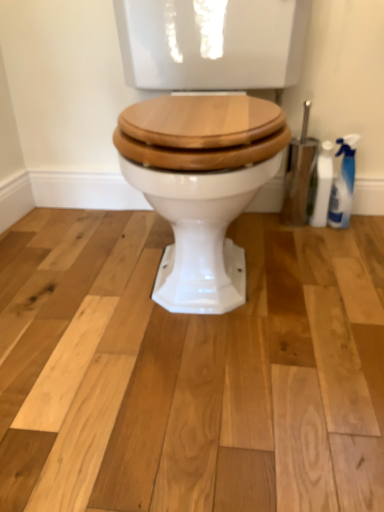
Where is `white plastic spray bottle at right, arranged as the 1th cleaning product when viewed from the left`? This screenshot has width=384, height=512. white plastic spray bottle at right, arranged as the 1th cleaning product when viewed from the left is located at coordinates (323, 185).

The height and width of the screenshot is (512, 384). Describe the element at coordinates (323, 185) in the screenshot. I see `white plastic spray bottle at right, arranged as the 1th cleaning product when viewed from the left` at that location.

What is the approximate width of white plastic spray bottle at right, arranged as the 1th cleaning product when viewed from the left?

The width of white plastic spray bottle at right, arranged as the 1th cleaning product when viewed from the left, is 5.87 centimeters.

How much space does translucent plastic spray bottle at right, arranged as the 1th cleaning product when viewed from the right, occupy vertically?

translucent plastic spray bottle at right, arranged as the 1th cleaning product when viewed from the right, is 29.59 centimeters tall.

This screenshot has width=384, height=512. What do you see at coordinates (343, 183) in the screenshot? I see `translucent plastic spray bottle at right, the 2th cleaning product from the left` at bounding box center [343, 183].

Identify the location of translucent plastic spray bottle at right, arranged as the 1th cleaning product when viewed from the right. The image size is (384, 512). (343, 183).

Consider the image. In order to face translucent plastic spray bottle at right, the 2th cleaning product from the left, should I rotate leftwards or rightwards?

To align with it, rotate right about 19.629°.

At what (x,y) coordinates should I click in order to perform the action: click on white plastic spray bottle at right, arranged as the 1th cleaning product when viewed from the left. Please return your answer as a coordinate pair (x, y). This screenshot has height=512, width=384. Looking at the image, I should click on (323, 185).

Between translucent plastic spray bottle at right, arranged as the 1th cleaning product when viewed from the right, and white plastic spray bottle at right, which ranks as the second cleaning product in right-to-left order, which one appears on the left side from the viewer's perspective?

white plastic spray bottle at right, which ranks as the second cleaning product in right-to-left order.

Does translucent plastic spray bottle at right, the 2th cleaning product from the left, lie in front of white plastic spray bottle at right, which ranks as the second cleaning product in right-to-left order?

Yes, translucent plastic spray bottle at right, the 2th cleaning product from the left, is closer to the viewer.

Does point (346, 194) come behind point (329, 194)?

No, it is in front of (329, 194).

Looking at this image, from the image's perspective, is translucent plastic spray bottle at right, arranged as the 1th cleaning product when viewed from the right, on top of white plastic spray bottle at right, which ranks as the second cleaning product in right-to-left order?

Yes.

From a real-world perspective, is translucent plastic spray bottle at right, arranged as the 1th cleaning product when viewed from the right, physically located above or below white plastic spray bottle at right, arranged as the 1th cleaning product when viewed from the left?

translucent plastic spray bottle at right, arranged as the 1th cleaning product when viewed from the right, is above white plastic spray bottle at right, arranged as the 1th cleaning product when viewed from the left.

Is translucent plastic spray bottle at right, arranged as the 1th cleaning product when viewed from the right, thinner than white plastic spray bottle at right, which ranks as the second cleaning product in right-to-left order?

No.

Considering the sizes of translucent plastic spray bottle at right, the 2th cleaning product from the left, and white plastic spray bottle at right, which ranks as the second cleaning product in right-to-left order, in the image, is translucent plastic spray bottle at right, the 2th cleaning product from the left, taller or shorter than white plastic spray bottle at right, which ranks as the second cleaning product in right-to-left order,?

In the image, translucent plastic spray bottle at right, the 2th cleaning product from the left, appears to be taller than white plastic spray bottle at right, which ranks as the second cleaning product in right-to-left order.

Between translucent plastic spray bottle at right, arranged as the 1th cleaning product when viewed from the right, and white plastic spray bottle at right, which ranks as the second cleaning product in right-to-left order, which one has smaller size?

With smaller size is white plastic spray bottle at right, which ranks as the second cleaning product in right-to-left order.

Is white plastic spray bottle at right, arranged as the 1th cleaning product when viewed from the left, located within translucent plastic spray bottle at right, arranged as the 1th cleaning product when viewed from the right?

No, white plastic spray bottle at right, arranged as the 1th cleaning product when viewed from the left, is not a part of translucent plastic spray bottle at right, arranged as the 1th cleaning product when viewed from the right.

Is translucent plastic spray bottle at right, arranged as the 1th cleaning product when viewed from the right, not close to white plastic spray bottle at right, arranged as the 1th cleaning product when viewed from the left?

That's not correct — translucent plastic spray bottle at right, arranged as the 1th cleaning product when viewed from the right, is a little close to white plastic spray bottle at right, arranged as the 1th cleaning product when viewed from the left.

Is translucent plastic spray bottle at right, arranged as the 1th cleaning product when viewed from the right, positioned with its back to white plastic spray bottle at right, which ranks as the second cleaning product in right-to-left order?

No, translucent plastic spray bottle at right, arranged as the 1th cleaning product when viewed from the right,'s orientation is not away from white plastic spray bottle at right, which ranks as the second cleaning product in right-to-left order.

Identify the location of cleaning product above the white plastic spray bottle at right, arranged as the 1th cleaning product when viewed from the left (from a real-world perspective). pyautogui.click(x=343, y=183).

Which is more to the right, white plastic spray bottle at right, arranged as the 1th cleaning product when viewed from the left, or translucent plastic spray bottle at right, the 2th cleaning product from the left?

translucent plastic spray bottle at right, the 2th cleaning product from the left, is more to the right.

Based on the photo, between white plastic spray bottle at right, arranged as the 1th cleaning product when viewed from the left, and translucent plastic spray bottle at right, arranged as the 1th cleaning product when viewed from the right, which one is positioned behind?

Positioned behind is white plastic spray bottle at right, arranged as the 1th cleaning product when viewed from the left.

Does point (321, 214) appear closer or farther from the camera than point (344, 213)?

Clearly, point (321, 214) is more distant from the camera than point (344, 213).

From the image's perspective, is white plastic spray bottle at right, arranged as the 1th cleaning product when viewed from the left, above or below translucent plastic spray bottle at right, arranged as the 1th cleaning product when viewed from the right?

white plastic spray bottle at right, arranged as the 1th cleaning product when viewed from the left, is situated lower than translucent plastic spray bottle at right, arranged as the 1th cleaning product when viewed from the right, in the image.

From a real-world perspective, relative to translucent plastic spray bottle at right, arranged as the 1th cleaning product when viewed from the right, is white plastic spray bottle at right, which ranks as the second cleaning product in right-to-left order, vertically above or below?

white plastic spray bottle at right, which ranks as the second cleaning product in right-to-left order, is below translucent plastic spray bottle at right, arranged as the 1th cleaning product when viewed from the right.

Can you confirm if white plastic spray bottle at right, arranged as the 1th cleaning product when viewed from the left, is wider than translucent plastic spray bottle at right, arranged as the 1th cleaning product when viewed from the right?

Incorrect, the width of white plastic spray bottle at right, arranged as the 1th cleaning product when viewed from the left, does not surpass that of translucent plastic spray bottle at right, arranged as the 1th cleaning product when viewed from the right.

Between white plastic spray bottle at right, arranged as the 1th cleaning product when viewed from the left, and translucent plastic spray bottle at right, arranged as the 1th cleaning product when viewed from the right, which one has less height?

white plastic spray bottle at right, arranged as the 1th cleaning product when viewed from the left, is shorter.

Is white plastic spray bottle at right, which ranks as the second cleaning product in right-to-left order, bigger or smaller than translucent plastic spray bottle at right, arranged as the 1th cleaning product when viewed from the right?

Clearly, white plastic spray bottle at right, which ranks as the second cleaning product in right-to-left order, is smaller in size than translucent plastic spray bottle at right, arranged as the 1th cleaning product when viewed from the right.

Is translucent plastic spray bottle at right, arranged as the 1th cleaning product when viewed from the right, inside white plastic spray bottle at right, which ranks as the second cleaning product in right-to-left order?

No.

Does white plastic spray bottle at right, arranged as the 1th cleaning product when viewed from the left, touch translucent plastic spray bottle at right, arranged as the 1th cleaning product when viewed from the right?

Yes.

Based on the photo, is translucent plastic spray bottle at right, the 2th cleaning product from the left, at the back of white plastic spray bottle at right, which ranks as the second cleaning product in right-to-left order?

Correct, white plastic spray bottle at right, which ranks as the second cleaning product in right-to-left order, is looking away from translucent plastic spray bottle at right, the 2th cleaning product from the left.

Could you measure the distance between white plastic spray bottle at right, which ranks as the second cleaning product in right-to-left order, and translucent plastic spray bottle at right, arranged as the 1th cleaning product when viewed from the right?

white plastic spray bottle at right, which ranks as the second cleaning product in right-to-left order, and translucent plastic spray bottle at right, arranged as the 1th cleaning product when viewed from the right, are 3.73 centimeters apart from each other.

Image resolution: width=384 pixels, height=512 pixels. What are the coordinates of `cleaning product located underneath the translucent plastic spray bottle at right, arranged as the 1th cleaning product when viewed from the right (from a real-world perspective)` in the screenshot? It's located at (323, 185).

Where is `cleaning product lying below the translucent plastic spray bottle at right, the 2th cleaning product from the left (from the image's perspective)`? The image size is (384, 512). cleaning product lying below the translucent plastic spray bottle at right, the 2th cleaning product from the left (from the image's perspective) is located at coordinates 323,185.

I want to click on cleaning product that is above the white plastic spray bottle at right, which ranks as the second cleaning product in right-to-left order (from the image's perspective), so click(343, 183).